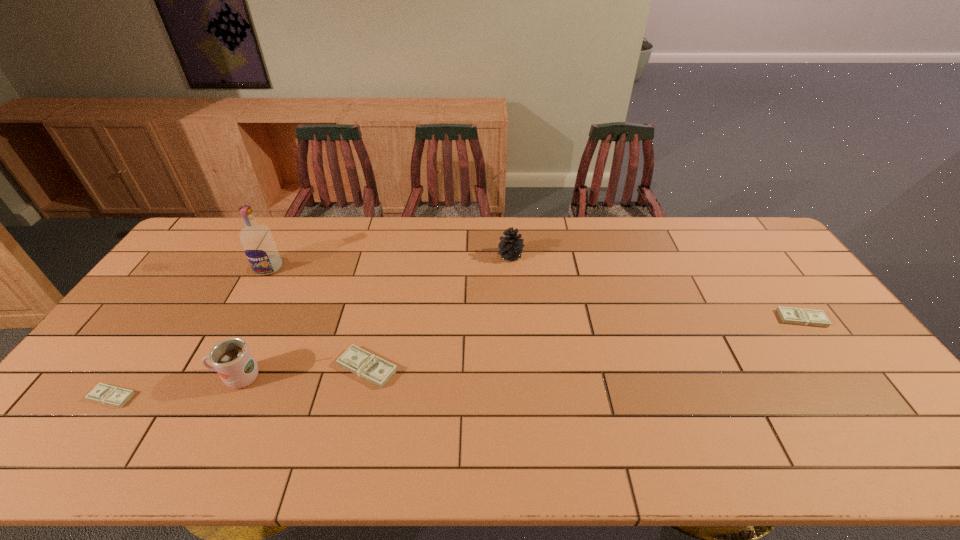
I want to click on the leftmost object, so click(110, 395).

Find the location of a particular element. This screenshot has height=540, width=960. the leftmost money is located at coordinates (110, 395).

Find the location of a particular element. Image resolution: width=960 pixels, height=540 pixels. the fourth tallest object is located at coordinates (368, 366).

In order to click on the second money from left to right in this screenshot , I will do `click(368, 366)`.

Identify the location of the rightmost object. (800, 316).

At what (x,y) coordinates should I click in order to perform the action: click on the fourth nearest object. Please return your answer as a coordinate pair (x, y). The height and width of the screenshot is (540, 960). Looking at the image, I should click on click(800, 316).

You are a GUI agent. You are given a task and a screenshot of the screen. Output one action in this format:
    pyautogui.click(x=<x>, y=<y>)
    Task: Click on the fifth object from left to right
    This screenshot has height=540, width=960.
    Given the screenshot: What is the action you would take?
    pyautogui.click(x=510, y=247)

Locate an element on the screen. pinecone is located at coordinates (510, 247).

Where is `vodka`? This screenshot has height=540, width=960. vodka is located at coordinates (258, 244).

In order to click on cup in this screenshot , I will do `click(232, 360)`.